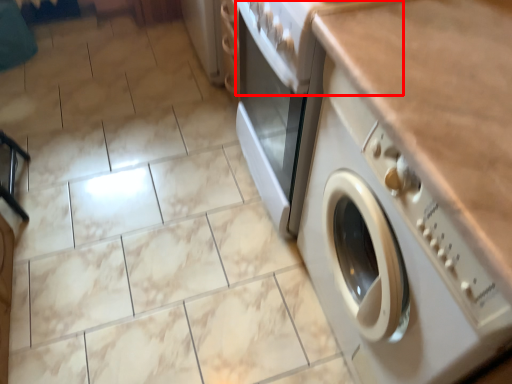
Question: From the image, what is the correct spatial relationship of gas stove (annotated by the red box) in relation to washing machine?

Choices:
 (A) left
 (B) right

Answer: (A)